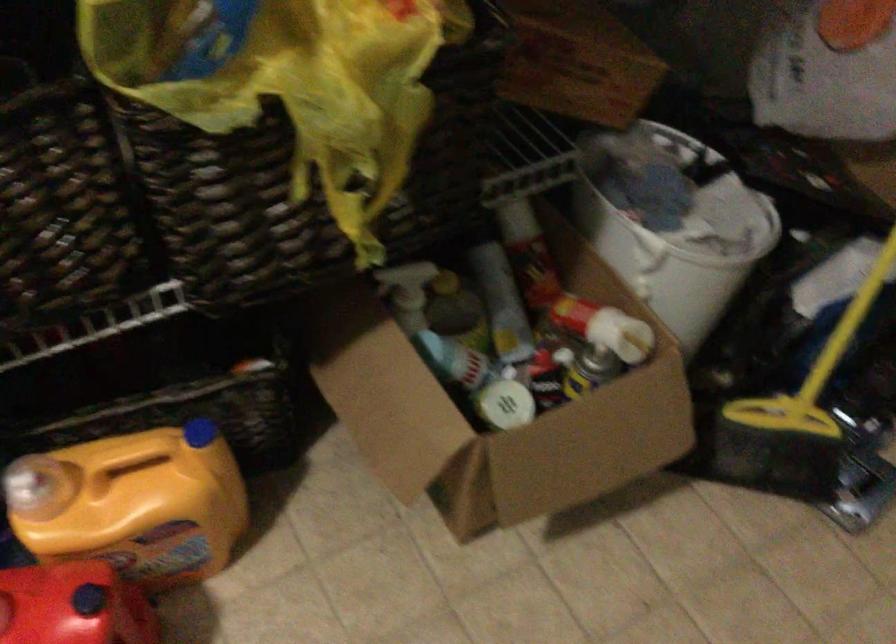
Find the location of `red aerosol can nozzle`. red aerosol can nozzle is located at coordinates (73, 605).